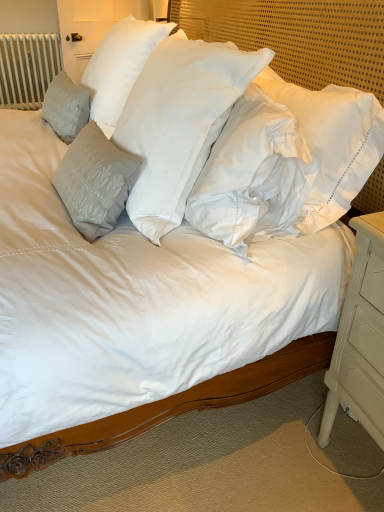
Question: Looking at their shapes, would you say white cotton pillow at center, arranged as the 1th pillow when viewed from the right, is wider or thinner than gray textured pillow at left, arranged as the third pillow when viewed from the right?

Choices:
 (A) wide
 (B) thin

Answer: (A)

Question: Considering the positions of white cotton pillow at center, acting as the 3th pillow starting from the left, and gray textured pillow at left, which ranks as the 1th pillow in left-to-right order, in the image, is white cotton pillow at center, acting as the 3th pillow starting from the left, bigger or smaller than gray textured pillow at left, which ranks as the 1th pillow in left-to-right order,?

Choices:
 (A) small
 (B) big

Answer: (B)

Question: Which object is the closest to the satin gray pillow at left, the 2th pillow viewed from the left?

Choices:
 (A) gray textured pillow at left, which ranks as the 1th pillow in left-to-right order
 (B) white painted wood nightstand at lower right
 (C) white textured fabric at upper center
 (D) white painted metal radiator at upper left
 (E) white cotton pillow at center, acting as the 3th pillow starting from the left

Answer: (A)

Question: Which object is positioned farthest from the satin gray pillow at left, the 2th pillow positioned from the right?

Choices:
 (A) white painted wood nightstand at lower right
 (B) white painted metal radiator at upper left
 (C) white cotton pillow at center, acting as the 3th pillow starting from the left
 (D) gray textured pillow at left, which ranks as the 1th pillow in left-to-right order
 (E) white textured fabric at upper center

Answer: (B)